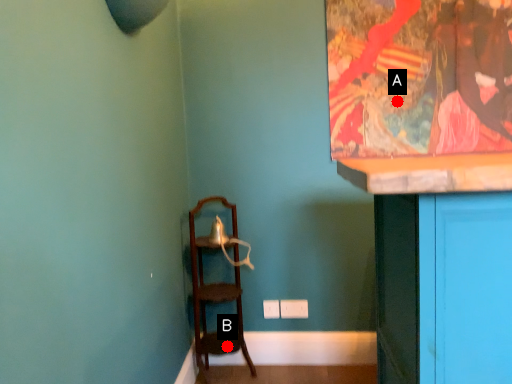
Question: Two points are circled on the image, labeled by A and B beside each circle. Which point is closer to the camera?

Choices:
 (A) A is closer
 (B) B is closer

Answer: (B)